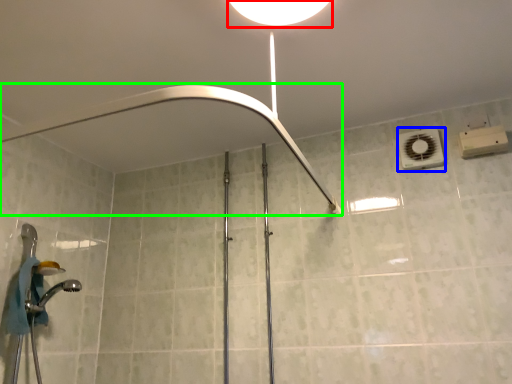
Question: Which is farther away from light fixture (highlighted by a red box)? air conditioner (highlighted by a blue box) or shower (highlighted by a green box)?

Choices:
 (A) air conditioner
 (B) shower

Answer: (A)